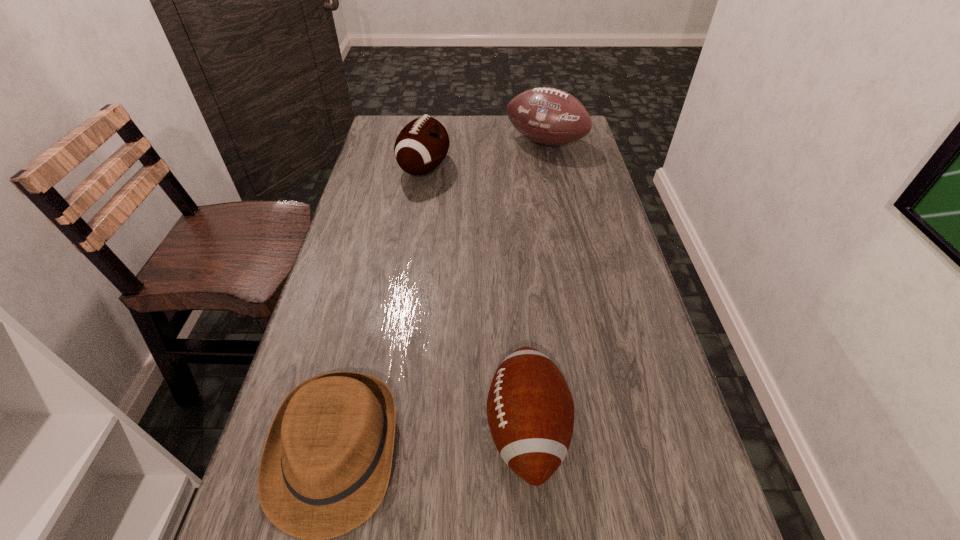
Image resolution: width=960 pixels, height=540 pixels. Identify the location of vacant space at the far edge. (515, 144).

This screenshot has height=540, width=960. What are the coordinates of `vacant space at the left edge of the desktop` in the screenshot? It's located at (341, 267).

Where is `free space at the right edge`? This screenshot has height=540, width=960. free space at the right edge is located at coordinates (617, 275).

This screenshot has width=960, height=540. What are the coordinates of `empty location between the leftmost football and the nearest football` in the screenshot? It's located at (475, 299).

The width and height of the screenshot is (960, 540). I want to click on free space between the leftmost football and the nearest football, so click(475, 299).

Where is `free spot between the leftmost football and the nearest football`? free spot between the leftmost football and the nearest football is located at coordinates (475, 299).

Locate an element on the screen. free area in between the leftmost football and the nearest football is located at coordinates (475, 299).

Identify which object is the third nearest to the leftmost football. Please provide its 2D coordinates. Your answer should be formatted as a tuple, i.e. [(x, y)], where the tuple contains the x and y coordinates of a point satisfying the conditions above.

[(325, 468)]

Locate which object is the third closest to the leftmost football. Please provide its 2D coordinates. Your answer should be formatted as a tuple, i.e. [(x, y)], where the tuple contains the x and y coordinates of a point satisfying the conditions above.

[(325, 468)]

At what (x,y) coordinates should I click in order to perform the action: click on the second closest football to the nearest football. Please return your answer as a coordinate pair (x, y). The width and height of the screenshot is (960, 540). Looking at the image, I should click on (552, 117).